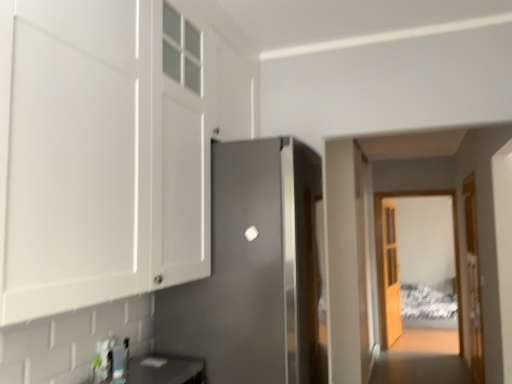
Question: Are wooden door at right, the 2th door when ordered from front to back, and white glossy cabinet at upper left far apart?

Choices:
 (A) yes
 (B) no

Answer: (A)

Question: Is wooden door at right, which appears as the 2th door when viewed from the back, closer to camera compared to white glossy cabinet at upper left?

Choices:
 (A) yes
 (B) no

Answer: (B)

Question: From a real-world perspective, is wooden door at right, which appears as the third door when viewed from the left, on top of white glossy cabinet at upper left?

Choices:
 (A) yes
 (B) no

Answer: (B)

Question: Is wooden door at right, the 2th door when ordered from front to back, facing towards white glossy cabinet at upper left?

Choices:
 (A) yes
 (B) no

Answer: (B)

Question: Does wooden door at right, which appears as the 2th door when viewed from the back, have a smaller size compared to white glossy cabinet at upper left?

Choices:
 (A) yes
 (B) no

Answer: (A)

Question: Looking at the image, does matte black countertop at lower left seem bigger or smaller compared to satin silver refrigerator at center, positioned as the 1th door in left-to-right order?

Choices:
 (A) big
 (B) small

Answer: (B)

Question: From the image's perspective, is matte black countertop at lower left located above or below satin silver refrigerator at center, which is counted as the 3th door, starting from the right?

Choices:
 (A) above
 (B) below

Answer: (B)

Question: Is matte black countertop at lower left inside the boundaries of satin silver refrigerator at center, positioned as the 1th door in left-to-right order, or outside?

Choices:
 (A) inside
 (B) outside

Answer: (B)

Question: Is matte black countertop at lower left in front of or behind satin silver refrigerator at center, positioned as the 1th door in left-to-right order, in the image?

Choices:
 (A) behind
 (B) front

Answer: (B)

Question: From the image's perspective, is white glossy cabinet at upper left located above or below clear glass door at center?

Choices:
 (A) above
 (B) below

Answer: (A)

Question: Considering their positions, is white glossy cabinet at upper left located in front of or behind clear glass door at center?

Choices:
 (A) front
 (B) behind

Answer: (A)

Question: Looking at the image, does white glossy cabinet at upper left seem bigger or smaller compared to clear glass door at center?

Choices:
 (A) big
 (B) small

Answer: (A)

Question: From a real-world perspective, is white glossy cabinet at upper left physically located above or below clear glass door at center?

Choices:
 (A) below
 (B) above

Answer: (B)

Question: Choose the correct answer: Is wooden textured door at center, positioned as the second door in right-to-left order, inside matte black countertop at lower left or outside it?

Choices:
 (A) outside
 (B) inside

Answer: (A)

Question: Based on their sizes in the image, would you say wooden textured door at center, placed as the 3th door when sorted from front to back, is bigger or smaller than matte black countertop at lower left?

Choices:
 (A) small
 (B) big

Answer: (B)